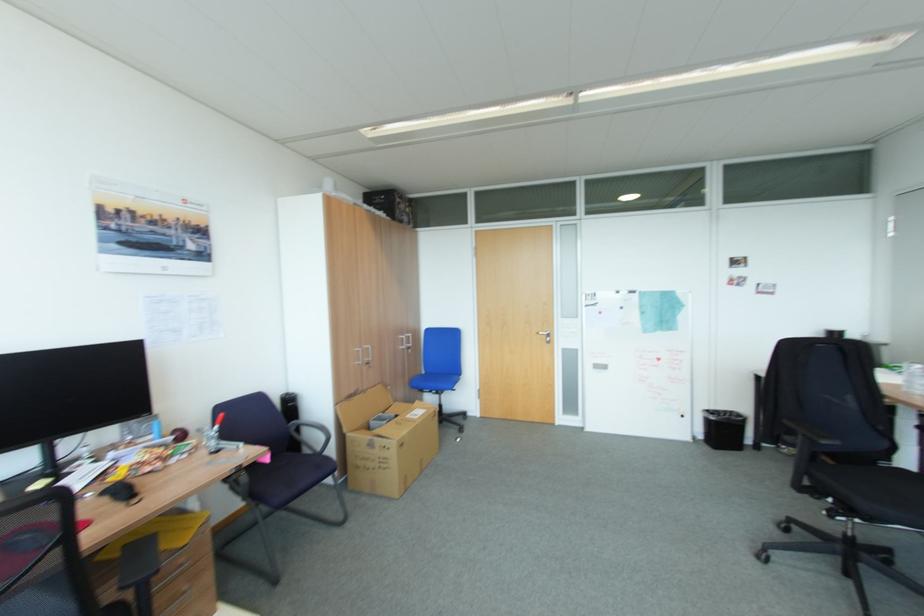
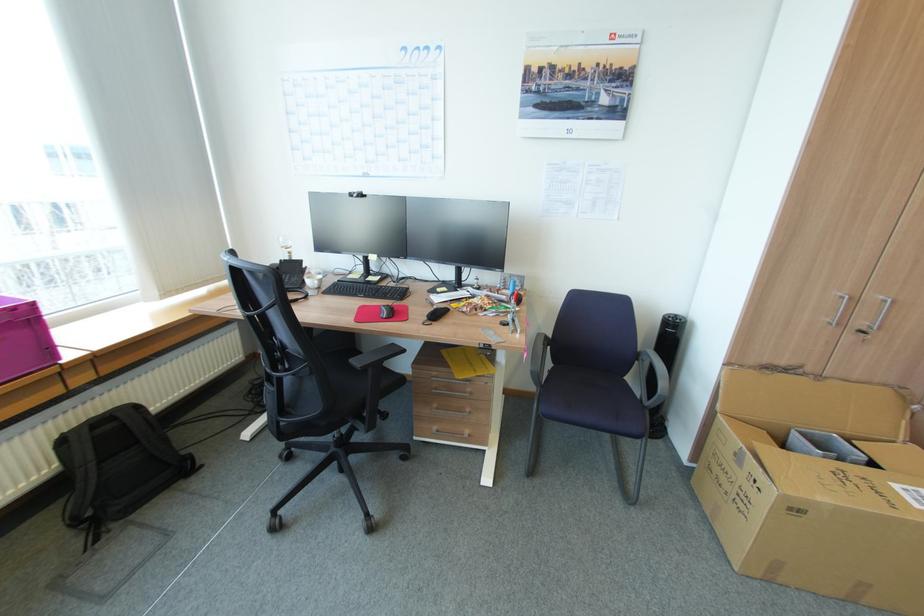
Locate, in the second image, the point that corresponds to pixel 365 363 in the first image.

(833, 323)